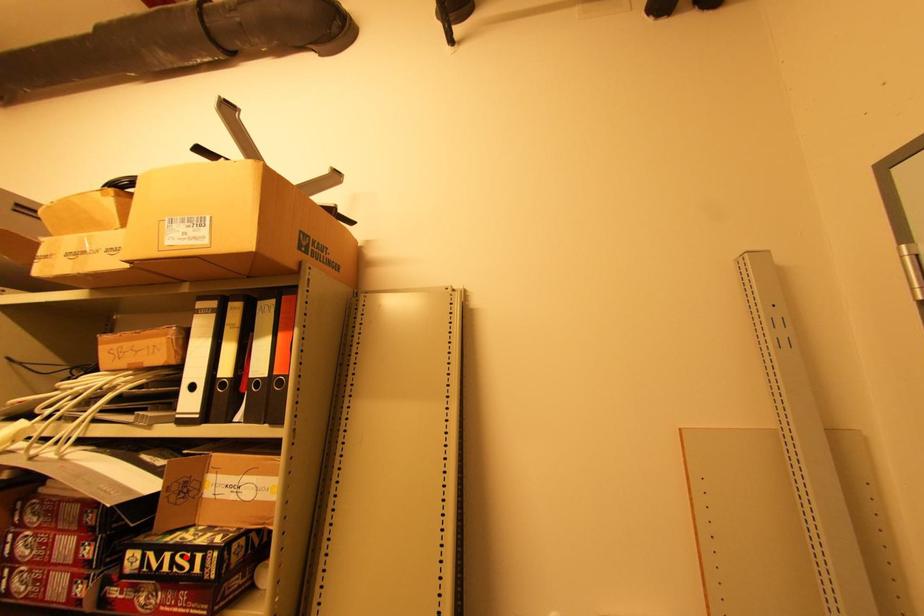
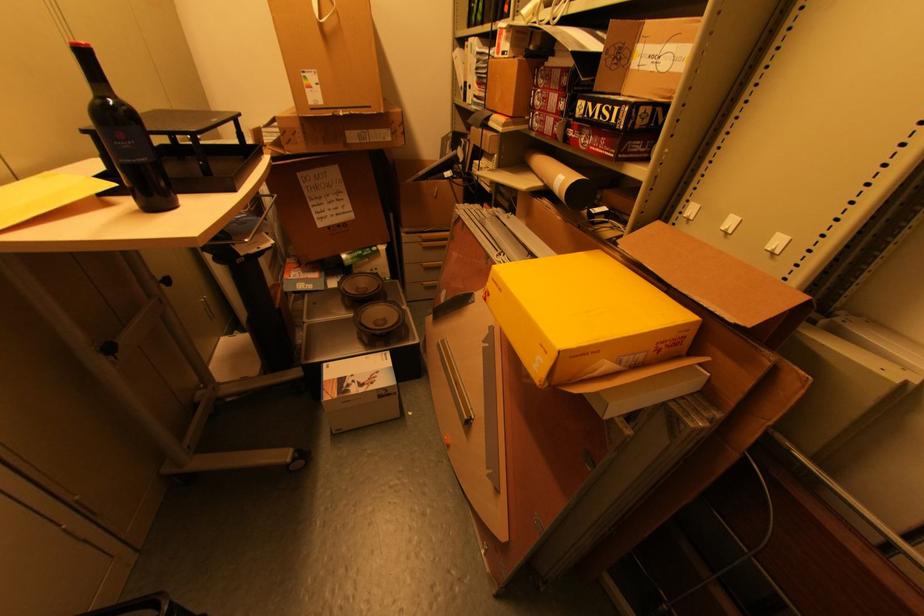
Question: I am providing you with two images of the same scene from different viewpoints. A red point is marked on the first image. Is the red point's position out of view in image 2?

Choices:
 (A) Yes
 (B) No

Answer: (B)